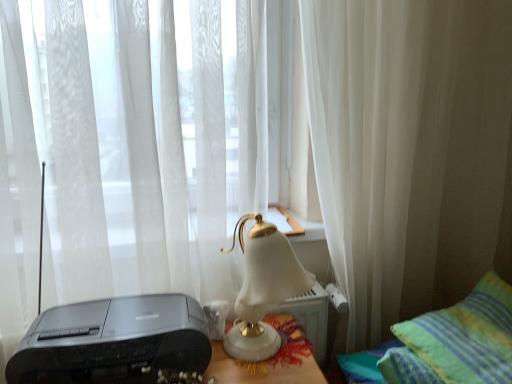
Question: From a real-world perspective, is white sheer curtain at center, placed as the 1th curtain when sorted from right to left, on green striped pillow at lower right?

Choices:
 (A) no
 (B) yes

Answer: (B)

Question: Does white sheer curtain at center, placed as the 1th curtain when sorted from right to left, lie in front of green striped pillow at lower right?

Choices:
 (A) yes
 (B) no

Answer: (B)

Question: From the image's perspective, does white sheer curtain at center, the second curtain when ordered from left to right, appear lower than green striped pillow at lower right?

Choices:
 (A) no
 (B) yes

Answer: (A)

Question: Is white sheer curtain at center, the second curtain when ordered from left to right, positioned far away from green striped pillow at lower right?

Choices:
 (A) yes
 (B) no

Answer: (B)

Question: Is white sheer curtain at center, the second curtain when ordered from left to right, taller than green striped pillow at lower right?

Choices:
 (A) no
 (B) yes

Answer: (B)

Question: Does white sheer curtain at center, placed as the 1th curtain when sorted from right to left, appear on the right side of green striped pillow at lower right?

Choices:
 (A) no
 (B) yes

Answer: (A)

Question: From a real-world perspective, is white sheer curtain at center, positioned as the 2th curtain in right-to-left order, over green striped pillow at lower right?

Choices:
 (A) no
 (B) yes

Answer: (B)

Question: Is white sheer curtain at center, arranged as the 1th curtain when viewed from the left, taller than green striped pillow at lower right?

Choices:
 (A) no
 (B) yes

Answer: (B)

Question: Can green striped pillow at lower right be found inside white sheer curtain at center, positioned as the 2th curtain in right-to-left order?

Choices:
 (A) yes
 (B) no

Answer: (B)

Question: Does white sheer curtain at center, positioned as the 2th curtain in right-to-left order, turn towards green striped pillow at lower right?

Choices:
 (A) yes
 (B) no

Answer: (B)

Question: From the image's perspective, does white sheer curtain at center, positioned as the 2th curtain in right-to-left order, appear lower than green striped pillow at lower right?

Choices:
 (A) no
 (B) yes

Answer: (A)

Question: Is the surface of white sheer curtain at center, arranged as the 1th curtain when viewed from the left, in direct contact with green striped pillow at lower right?

Choices:
 (A) no
 (B) yes

Answer: (A)

Question: Is white porcelain lamp at center located within white sheer curtain at center, the second curtain when ordered from left to right?

Choices:
 (A) yes
 (B) no

Answer: (B)